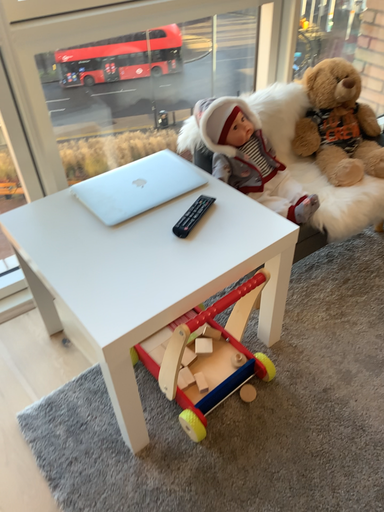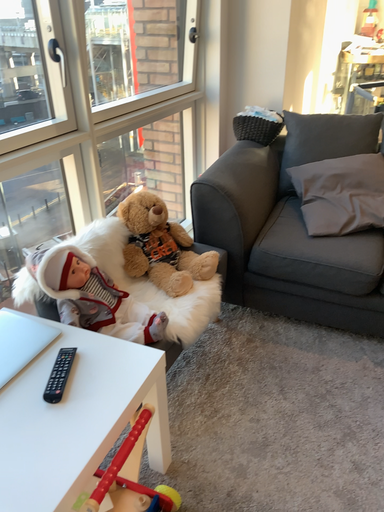
Question: How did the camera likely rotate when shooting the video?

Choices:
 (A) rotated left
 (B) rotated right

Answer: (B)